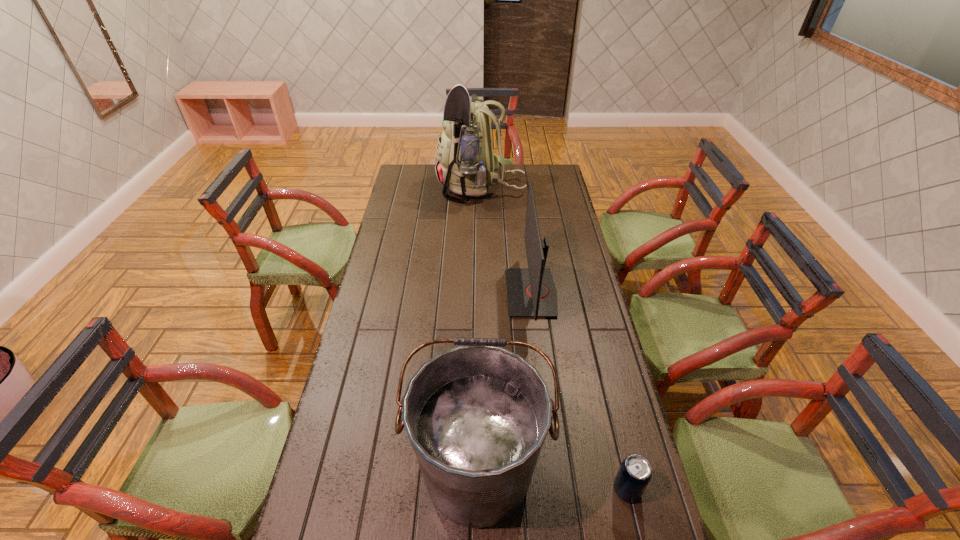
Find the location of `free region that satisfies the following two spatial constraints: 1. on the front-facing side of the tallest object; 2. on the back side of the shortest object`. free region that satisfies the following two spatial constraints: 1. on the front-facing side of the tallest object; 2. on the back side of the shortest object is located at coordinates (482, 490).

Where is `free location that satisfies the following two spatial constraints: 1. on the screen side of the shortest object; 2. on the right side of the second farthest object`? This screenshot has height=540, width=960. free location that satisfies the following two spatial constraints: 1. on the screen side of the shortest object; 2. on the right side of the second farthest object is located at coordinates (556, 490).

The height and width of the screenshot is (540, 960). I want to click on free space that satisfies the following two spatial constraints: 1. on the screen side of the monitor; 2. on the left side of the rightmost object, so click(x=556, y=490).

This screenshot has width=960, height=540. Identify the location of vacant space that satisfies the following two spatial constraints: 1. on the front-facing side of the soda can; 2. on the right side of the tallest object. (482, 490).